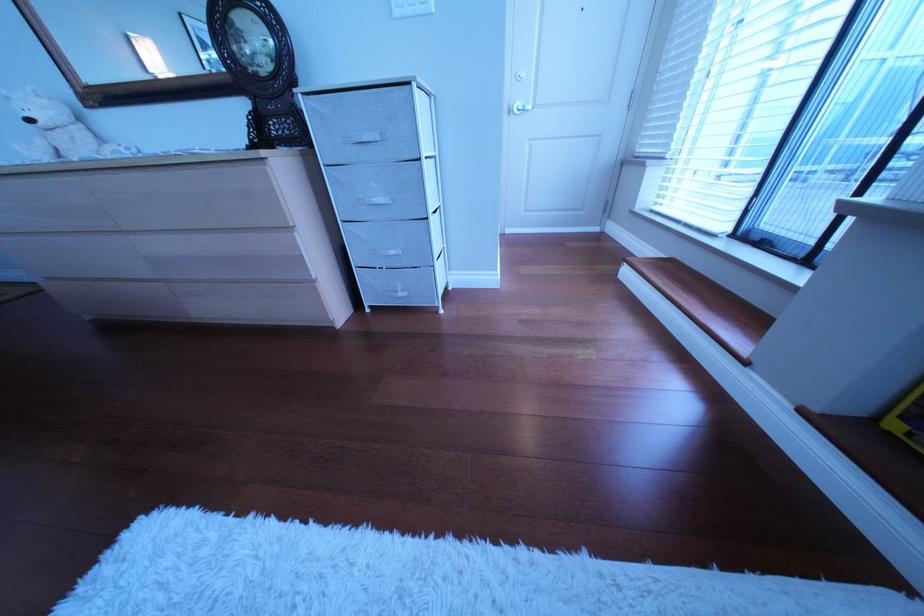
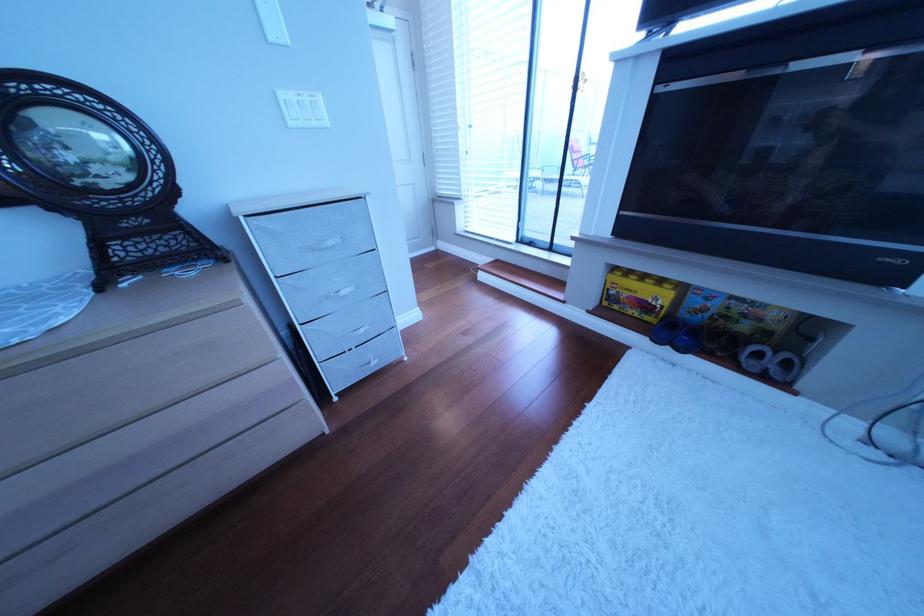
The point at (359, 140) is marked in the first image. Where is the corresponding point in the second image?

(317, 249)